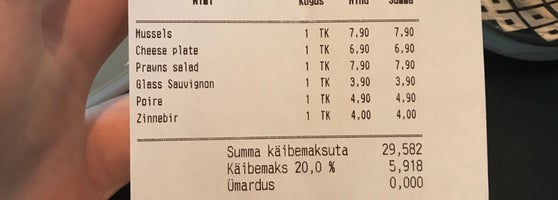
You are a GUI agent. You are given a task and a screenshot of the screen. Output one action in this format:
    pyautogui.click(x=<x>, y=<y>)
    Task: Click on the table
    This screenshot has width=558, height=200.
    Given the screenshot: What is the action you would take?
    pyautogui.click(x=525, y=50)